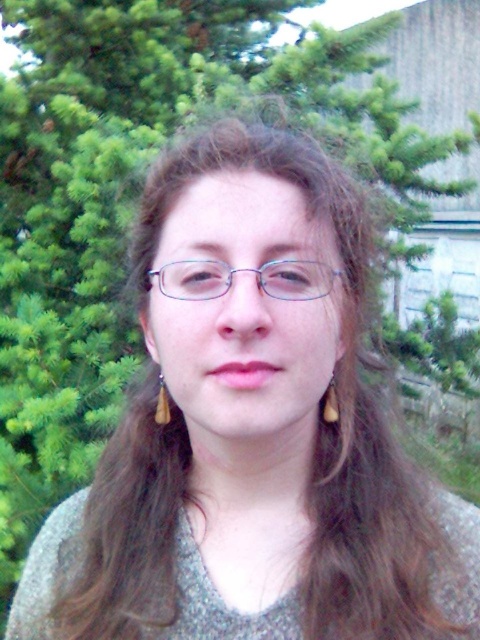
Can you confirm if brown leather earring at lower right is positioned to the left of brown leather earring at left?

No, brown leather earring at lower right is not to the left of brown leather earring at left.

Which is behind, point (330, 406) or point (163, 412)?

Positioned behind is point (163, 412).

Does point (334, 385) come behind point (158, 401)?

No, (334, 385) is in front of (158, 401).

Locate an element on the screen. This screenshot has height=640, width=480. brown leather earring at lower right is located at coordinates (330, 403).

Does clear plastic glasses at center appear on the right side of brown leather earring at left?

Yes, clear plastic glasses at center is to the right of brown leather earring at left.

Which is in front, point (223, 264) or point (165, 394)?

Point (223, 264) is more forward.

Find the location of a particular element. Image resolution: width=480 pixels, height=640 pixels. clear plastic glasses at center is located at coordinates (244, 272).

From the picture: Does clear plastic glasses at center have a larger size compared to brown leather earring at lower right?

Yes, clear plastic glasses at center is bigger than brown leather earring at lower right.

Describe the element at coordinates (244, 272) in the screenshot. This screenshot has height=640, width=480. I see `clear plastic glasses at center` at that location.

At what (x,y) coordinates should I click in order to perform the action: click on clear plastic glasses at center. Please return your answer as a coordinate pair (x, y). The image size is (480, 640). Looking at the image, I should click on (x=244, y=272).